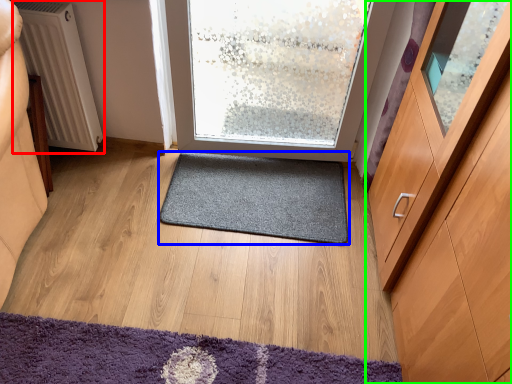
Question: Considering the real-world distances, which object is closest to radiator (highlighted by a red box)? mat (highlighted by a blue box) or cabinetry (highlighted by a green box).

Choices:
 (A) mat
 (B) cabinetry

Answer: (A)